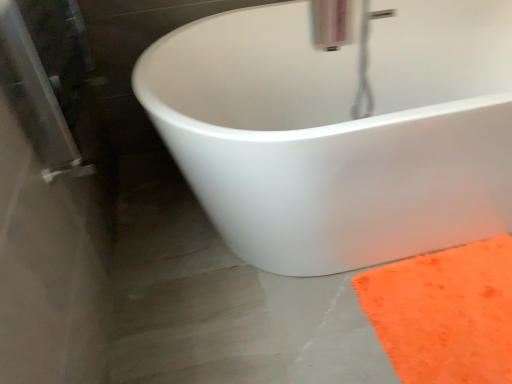
The image size is (512, 384). In order to click on vacant region under orange fuzzy rug at lower right (from a real-world perspective) in this screenshot , I will do `click(456, 312)`.